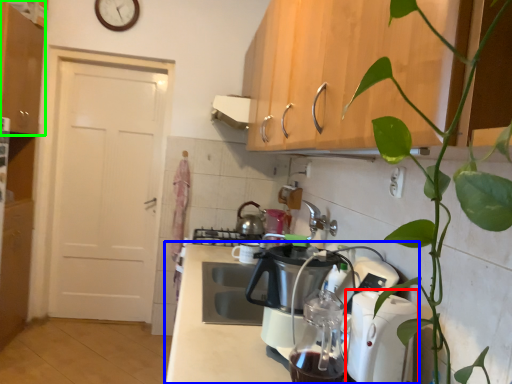
Question: Which is nearer to the kitchen appliance (highlighted by a red box)? countertop (highlighted by a blue box) or cabinetry (highlighted by a green box).

Choices:
 (A) countertop
 (B) cabinetry

Answer: (A)